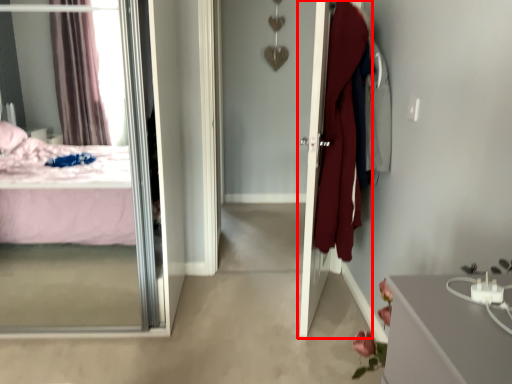
Question: From the image's perspective, considering the relative positions of door (annotated by the red box) and mirror in the image provided, where is door (annotated by the red box) located with respect to the staircase?

Choices:
 (A) below
 (B) above

Answer: (B)